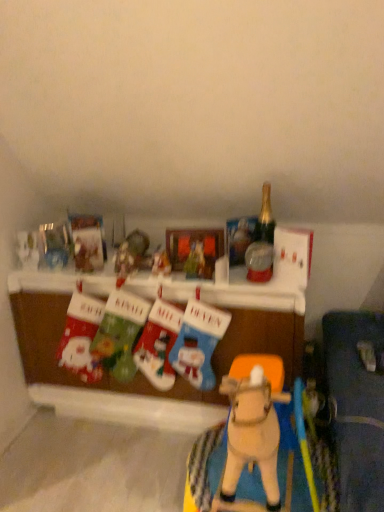
Question: Does matte plastic picture frame at center have a lesser height compared to knitted wool stocking at center, which ranks as the fifth toy in left-to-right order?

Choices:
 (A) yes
 (B) no

Answer: (A)

Question: Does matte plastic picture frame at center have a greater height compared to knitted wool stocking at center, which ranks as the fifth toy in left-to-right order?

Choices:
 (A) no
 (B) yes

Answer: (A)

Question: From a real-world perspective, is matte plastic picture frame at center on knitted wool stocking at center, marked as the 2th toy in a right-to-left arrangement?

Choices:
 (A) yes
 (B) no

Answer: (A)

Question: Considering the relative positions of matte plastic picture frame at center and knitted wool stocking at center, marked as the 2th toy in a right-to-left arrangement, in the image provided, is matte plastic picture frame at center to the right of knitted wool stocking at center, marked as the 2th toy in a right-to-left arrangement, from the viewer's perspective?

Choices:
 (A) no
 (B) yes

Answer: (A)

Question: Are matte plastic picture frame at center and knitted wool stocking at center, which ranks as the fifth toy in left-to-right order, beside each other?

Choices:
 (A) no
 (B) yes

Answer: (A)

Question: Would you consider matte plastic picture frame at center to be distant from knitted wool stocking at center, marked as the 2th toy in a right-to-left arrangement?

Choices:
 (A) yes
 (B) no

Answer: (B)

Question: Does knitted wool stocking at center, which ranks as the fifth toy in left-to-right order, turn towards wooden horse at center, the 6th toy from the left?

Choices:
 (A) yes
 (B) no

Answer: (B)

Question: Is knitted wool stocking at center, which ranks as the fifth toy in left-to-right order, wider than wooden horse at center, the 6th toy from the left?

Choices:
 (A) no
 (B) yes

Answer: (A)

Question: Is the position of knitted wool stocking at center, marked as the 2th toy in a right-to-left arrangement, less distant than that of wooden horse at center, the 6th toy from the left?

Choices:
 (A) yes
 (B) no

Answer: (B)

Question: Is knitted wool stocking at center, marked as the 2th toy in a right-to-left arrangement, positioned with its back to wooden horse at center, placed as the first toy when sorted from right to left?

Choices:
 (A) yes
 (B) no

Answer: (B)

Question: Can you confirm if knitted wool stocking at center, marked as the 2th toy in a right-to-left arrangement, is smaller than wooden horse at center, the 6th toy from the left?

Choices:
 (A) yes
 (B) no

Answer: (A)

Question: Considering the relative positions of knitted wool stocking at center, which ranks as the fifth toy in left-to-right order, and wooden horse at center, the 6th toy from the left, in the image provided, is knitted wool stocking at center, which ranks as the fifth toy in left-to-right order, to the right of wooden horse at center, the 6th toy from the left, from the viewer's perspective?

Choices:
 (A) no
 (B) yes

Answer: (A)

Question: Does wooden horse at center, placed as the first toy when sorted from right to left, appear on the right side of matte plastic ornament at center, arranged as the 4th toy when viewed from the left?

Choices:
 (A) yes
 (B) no

Answer: (A)